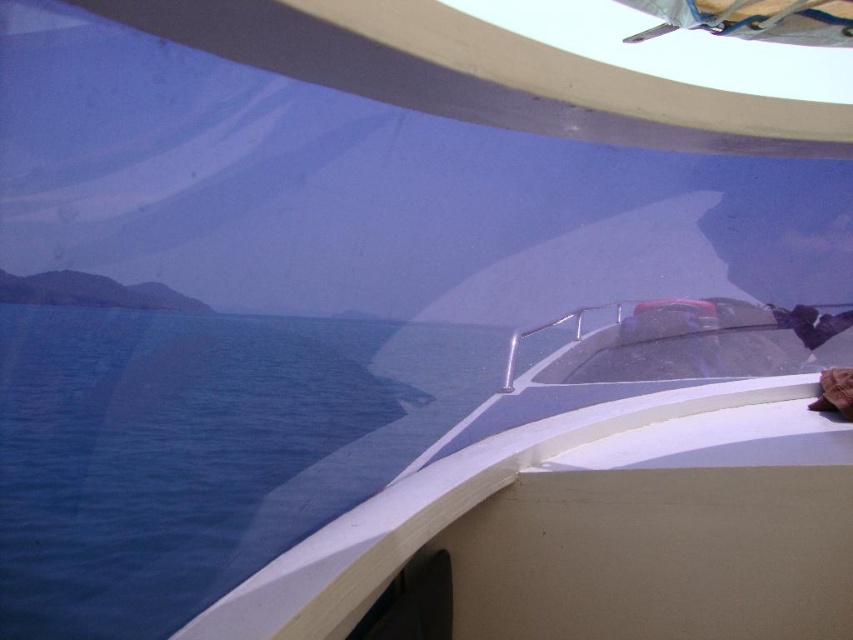
Is white glossy boat at center below blue water at lower left?

Indeed, white glossy boat at center is positioned under blue water at lower left.

Does white glossy boat at center appear on the left side of blue water at lower left?

No, white glossy boat at center is not to the left of blue water at lower left.

You are a GUI agent. You are given a task and a screenshot of the screen. Output one action in this format:
    pyautogui.click(x=<x>, y=<y>)
    Task: Click on the white glossy boat at center
    The image size is (853, 640).
    Given the screenshot: What is the action you would take?
    pyautogui.click(x=602, y=499)